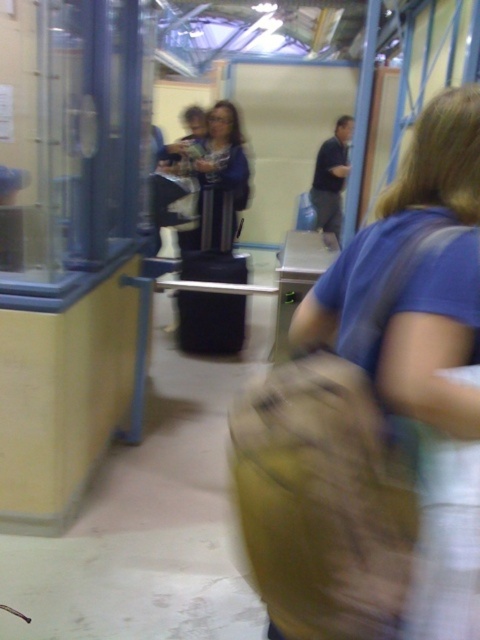
Question: Is brown fabric bag at center above blue fabric jacket at center?

Choices:
 (A) no
 (B) yes

Answer: (A)

Question: Where is brown fabric bag at center located in relation to blue fabric jacket at center in the image?

Choices:
 (A) above
 (B) below

Answer: (B)

Question: Does brown fabric bag at center appear over blue fabric jacket at center?

Choices:
 (A) no
 (B) yes

Answer: (A)

Question: Among these points, which one is nearest to the camera?

Choices:
 (A) (211, 180)
 (B) (399, 317)

Answer: (B)

Question: Which object appears farthest from the camera in this image?

Choices:
 (A) blue fabric jacket at center
 (B) brown fabric bag at center

Answer: (A)